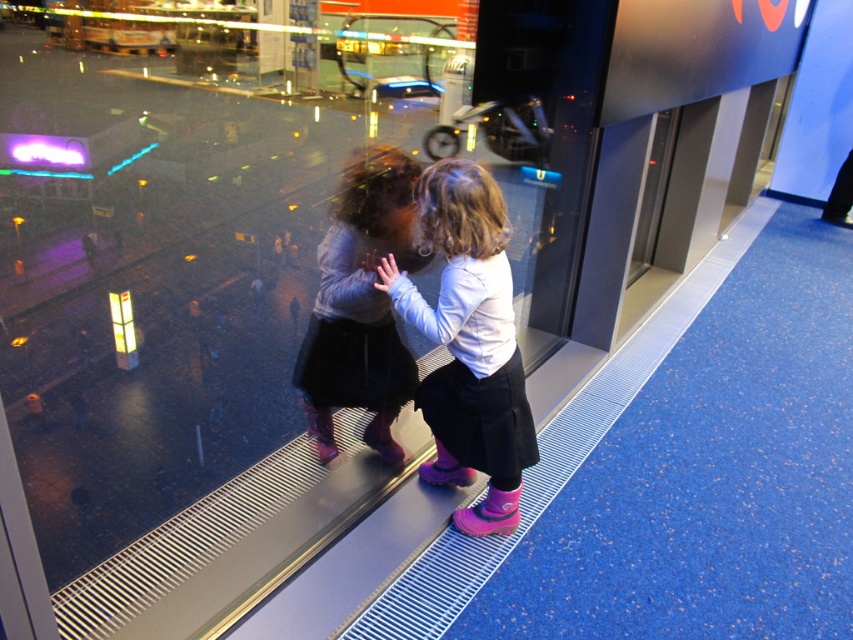
Question: Which point is closer to the camera?

Choices:
 (A) pink rubber boots at center
 (B) matte gray sweater at center

Answer: (A)

Question: Which point is farther to the camera?

Choices:
 (A) (374, 353)
 (B) (485, 387)

Answer: (A)

Question: Does pink rubber boots at center have a larger size compared to matte gray sweater at center?

Choices:
 (A) no
 (B) yes

Answer: (A)

Question: In this image, where is pink rubber boots at center located relative to matte gray sweater at center?

Choices:
 (A) right
 (B) left

Answer: (A)

Question: Is pink rubber boots at center further to camera compared to matte gray sweater at center?

Choices:
 (A) yes
 (B) no

Answer: (B)